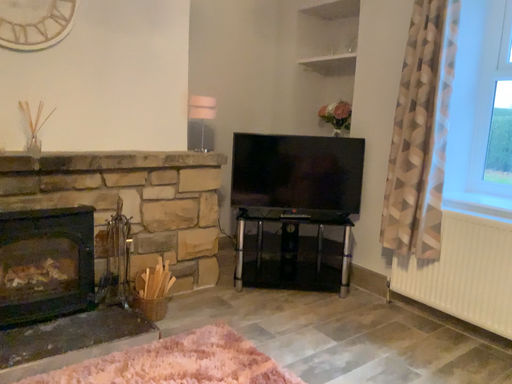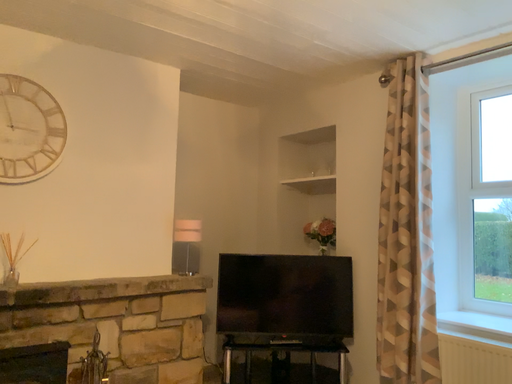
Question: Which way did the camera rotate in the video?

Choices:
 (A) rotated downward
 (B) rotated upward

Answer: (B)